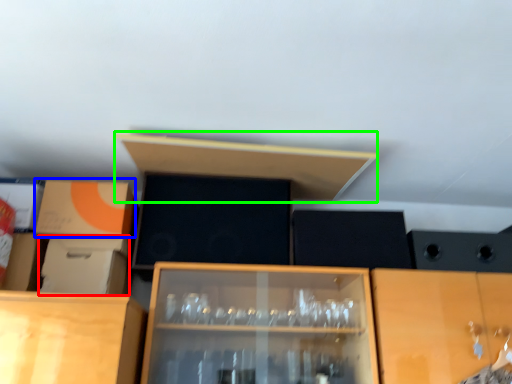
Question: Estimate the real-world distances between objects in this image. Which object is closer to cardboard box (highlighted by a red box), cardboard box (highlighted by a blue box) or shelf (highlighted by a green box)?

Choices:
 (A) cardboard box
 (B) shelf

Answer: (A)